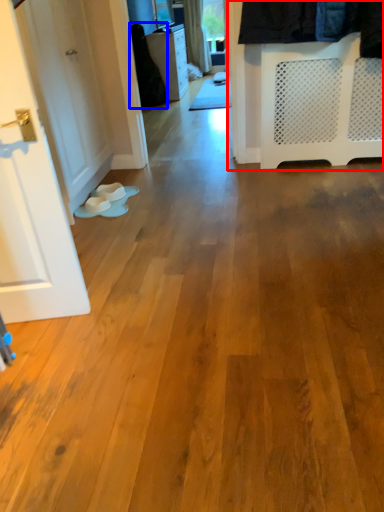
Question: Which of the following is the farthest to the observer, closet (highlighted by a red box) or clothing (highlighted by a blue box)?

Choices:
 (A) closet
 (B) clothing

Answer: (B)